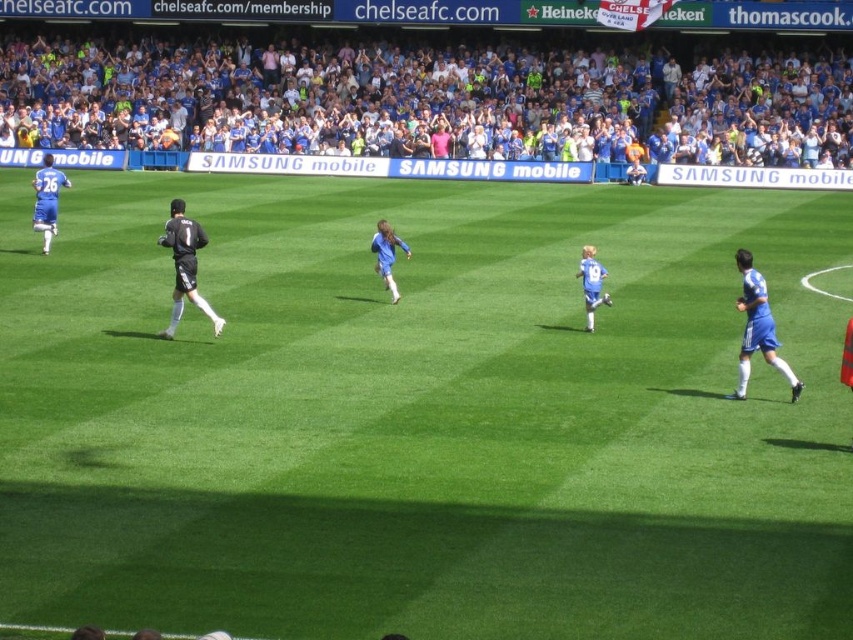
Between blue fabric crowd at upper center and black matte jersey at center, which one appears on the right side from the viewer's perspective?

black matte jersey at center is more to the right.

Which is above, blue fabric crowd at upper center or black matte jersey at center?

blue fabric crowd at upper center

Is point (248, 90) behind point (187, 272)?

Yes, it is.

The height and width of the screenshot is (640, 853). Identify the location of blue fabric crowd at upper center. (422, 99).

Describe the element at coordinates (421, 416) in the screenshot. I see `green grass soccer field at center` at that location.

Does point (704, 250) come behind point (741, 371)?

Yes, point (704, 250) is farther from viewer.

Consider the image. Who is more forward, [177,477] or [796,396]?

Point [177,477]

Find the location of a particular element. This screenshot has width=853, height=640. green grass soccer field at center is located at coordinates click(x=421, y=416).

Is blue fabric crowd at upper center to the left of blue jersey soccer player at left from the viewer's perspective?

Incorrect, blue fabric crowd at upper center is not on the left side of blue jersey soccer player at left.

Is point (358, 113) positioned before point (57, 188)?

No, (358, 113) is further to viewer.

This screenshot has width=853, height=640. Find the location of `blue fabric crowd at upper center`. blue fabric crowd at upper center is located at coordinates (422, 99).